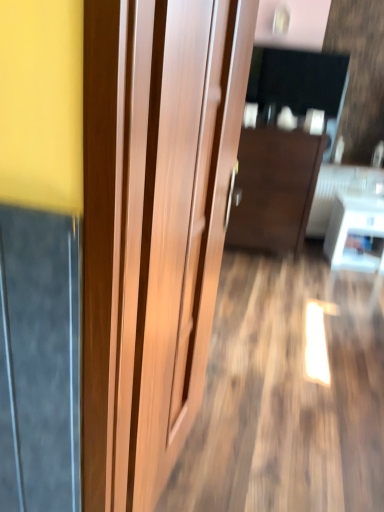
Find the location of a particular element. The height and width of the screenshot is (512, 384). white glossy table at lower right is located at coordinates (356, 233).

Considering the sizes of objects dark wood cabinet at center and wooden door at center in the image provided, who is taller, dark wood cabinet at center or wooden door at center?

wooden door at center.

In the image, there is a wooden door at center. In order to click on furniture below it (from a real-world perspective) in this screenshot , I will do `click(274, 189)`.

Is dark wood cabinet at center surrounding wooden door at center?

No, wooden door at center is located outside of dark wood cabinet at center.

From a real-world perspective, who is located lower, dark wood cabinet at center or wooden door at center?

dark wood cabinet at center, from a real-world perspective.

In the scene shown: Could you tell me if dark wood cabinet at center is facing white glossy table at lower right?

No, dark wood cabinet at center is not facing towards white glossy table at lower right.

Is white glossy table at lower right surrounded by dark wood cabinet at center?

No, white glossy table at lower right is located outside of dark wood cabinet at center.

From the image's perspective, is dark wood cabinet at center over white glossy table at lower right?

Yes, from the image's perspective, dark wood cabinet at center is over white glossy table at lower right.

Looking at this image, from a real-world perspective, is dark wood cabinet at center above or below white glossy table at lower right?

From a real-world perspective, dark wood cabinet at center is physically above white glossy table at lower right.

Between white glossy table at lower right and wooden door at center, which one is positioned in front?

wooden door at center.

Is white glossy table at lower right positioned with its back to wooden door at center?

No, white glossy table at lower right's orientation is not away from wooden door at center.

Considering the relative sizes of white glossy table at lower right and wooden door at center in the image provided, is white glossy table at lower right thinner than wooden door at center?

In fact, white glossy table at lower right might be wider than wooden door at center.

Is point (371, 234) closer to camera compared to point (160, 193)?

No.

Are white glossy table at lower right and dark wood cabinet at center beside each other?

There is a gap between white glossy table at lower right and dark wood cabinet at center.

How much distance is there between white glossy table at lower right and dark wood cabinet at center?

white glossy table at lower right is 22.74 inches away from dark wood cabinet at center.

Can you confirm if white glossy table at lower right is bigger than dark wood cabinet at center?

No.

Considering the sizes of objects white glossy table at lower right and dark wood cabinet at center in the image provided, who is taller, white glossy table at lower right or dark wood cabinet at center?

Standing taller between the two is dark wood cabinet at center.

Between point (142, 397) and point (269, 193), which one is positioned behind?

The point (269, 193) is more distant.

Which object is positioned more to the left, wooden door at center or dark wood cabinet at center?

From the viewer's perspective, wooden door at center appears more on the left side.

Would you say wooden door at center is inside or outside dark wood cabinet at center?

wooden door at center is spatially situated outside dark wood cabinet at center.

Is wooden door at center bigger or smaller than dark wood cabinet at center?

Considering their sizes, wooden door at center takes up less space than dark wood cabinet at center.

In the scene shown: How much distance is there between wooden door at center and white glossy table at lower right?

wooden door at center and white glossy table at lower right are 8.78 feet apart.

From the image's perspective, relative to white glossy table at lower right, is wooden door at center above or below?

Clearly, from the image's perspective, wooden door at center is below white glossy table at lower right.

Which is more to the right, wooden door at center or white glossy table at lower right?

white glossy table at lower right is more to the right.

Identify the location of furniture on the right of wooden door at center. This screenshot has width=384, height=512. (274, 189).

Locate an element on the screen. furniture that is on the left side of white glossy table at lower right is located at coordinates (274, 189).

When comparing their distances from dark wood cabinet at center, does wooden door at center or white glossy table at lower right seem further?

wooden door at center lies further to dark wood cabinet at center than the other object.

When comparing their distances from white glossy table at lower right, does dark wood cabinet at center or wooden door at center seem closer?

The object closer to white glossy table at lower right is dark wood cabinet at center.

When comparing their distances from dark wood cabinet at center, does white glossy table at lower right or wooden door at center seem further?

wooden door at center.

From the image, which object appears to be nearer to wooden door at center, white glossy table at lower right or dark wood cabinet at center?

Based on the image, dark wood cabinet at center appears to be nearer to wooden door at center.

From the image, which object appears to be farther from white glossy table at lower right, wooden door at center or dark wood cabinet at center?

wooden door at center is further to white glossy table at lower right.

Looking at the image, which one is located further to wooden door at center, dark wood cabinet at center or white glossy table at lower right?

Based on the image, white glossy table at lower right appears to be further to wooden door at center.

The width and height of the screenshot is (384, 512). Identify the location of furniture located between wooden door at center and white glossy table at lower right in the depth direction. [274, 189].